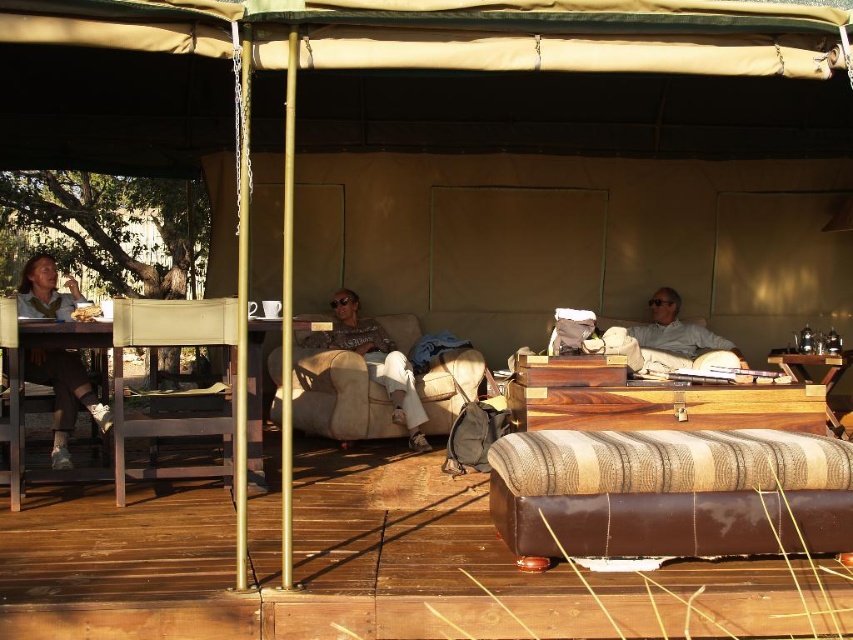
You are a guest in this tent and want to sit down comfortably. The metallic silver armchair at left and the matte gray sweater at center are both available. Which one is shorter and thus better for sitting?

The metallic silver armchair at left is shorter than the matte gray sweater at center, so it would be better for sitting.

You are a tour guide leading a group through a safari camp. You need to ensure that a 2 meter long banner can be placed horizontally between the wooden box at center and the metallic silver armchair at left without touching either. Is this possible?

The distance between the wooden box at center and the metallic silver armchair at left is 1.98 meters, which is slightly shorter than the 2 meter long banner. Therefore, placing the banner horizontally between them without touching either would not be possible as the space is insufficient.